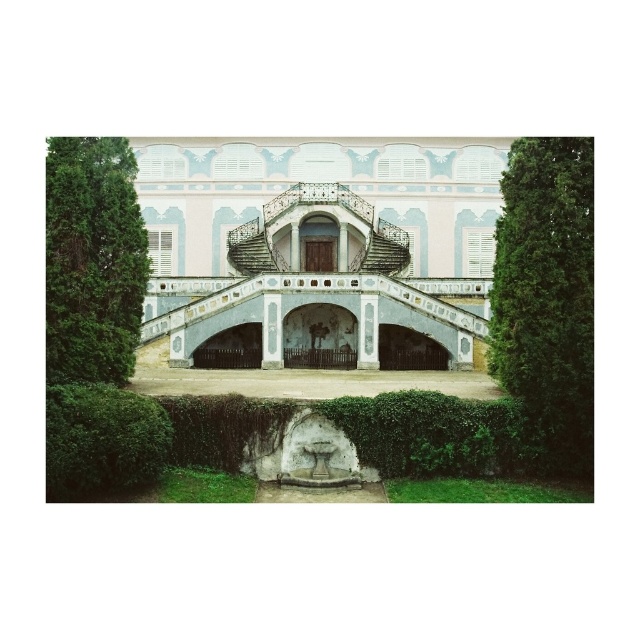
You are a gardener planning to trim the hedges in the scene. Which hedge, the green ivy hedge at lower center or the green leafy hedge at left, is positioned lower in the image?

The green ivy hedge at lower center is positioned lower than the green leafy hedge at left.

You are a landscape architect designing a pathway between the green ivy hedge at lower center and the green leafy hedge at left. Which hedge will the pathway need to go around due to its height?

The pathway will need to go around the green leafy hedge at left because it is taller than the green ivy hedge at lower center.

You are a landscape architect designing a new garden. You have to place a large statue that requires a space larger than the green ivy hedge at lower center. Can the space in front of the pastel painted palace at center accommodate the statue?

The pastel painted palace at center is bigger than the green ivy hedge at lower center, so the space in front of the pastel painted palace at center can accommodate the statue since it is larger than the hedge.